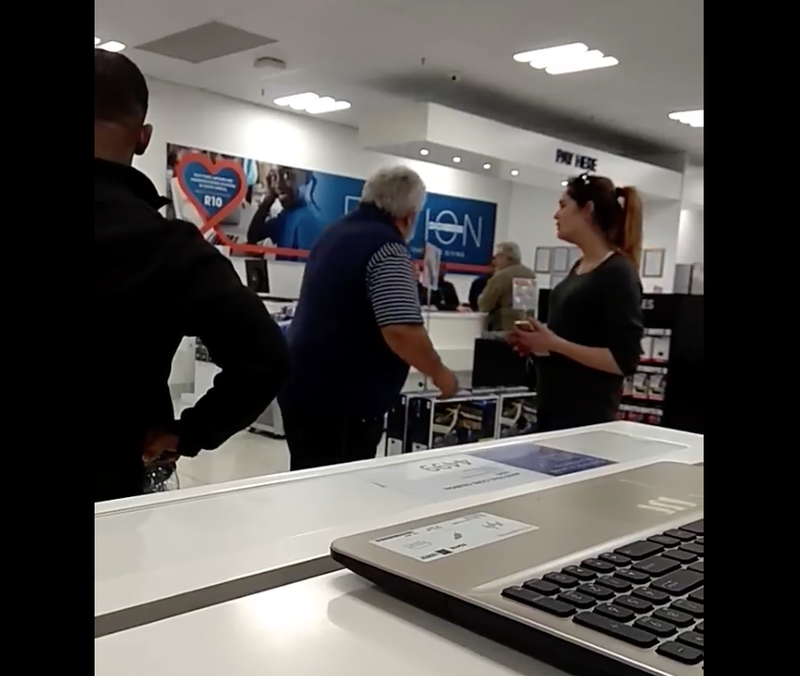
The width and height of the screenshot is (800, 676). Identify the location of sticker. (524, 462).